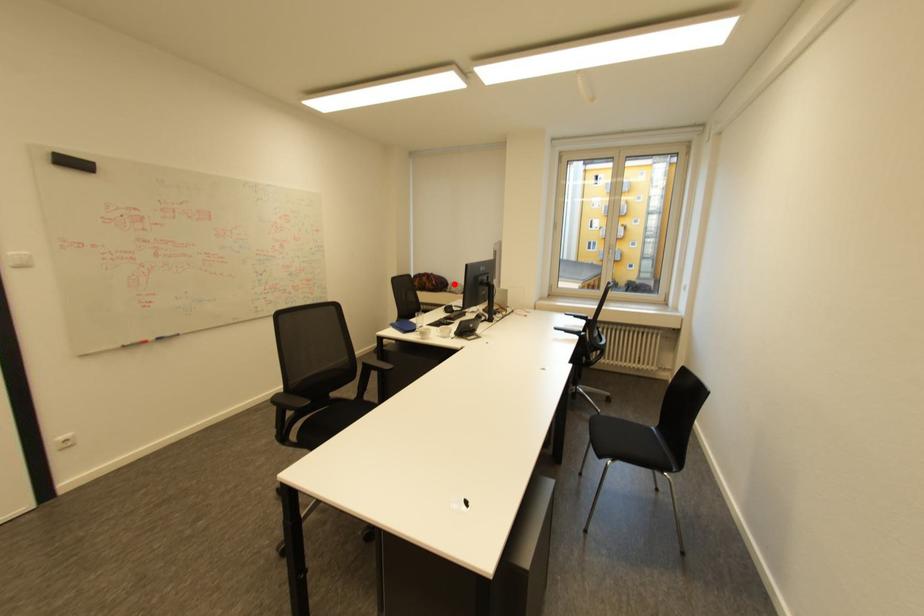
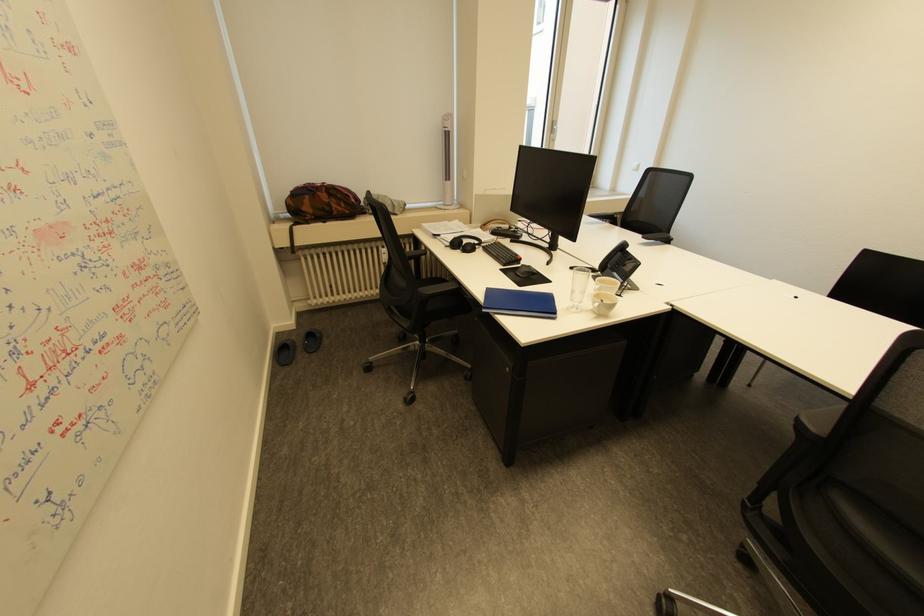
Question: I am providing you with two images of the same scene from different viewpoints. A red point is shown in image1. For the corresponding object point in image2, is it positioned nearer or farther from the camera?

Choices:
 (A) Nearer
 (B) Farther

Answer: (B)